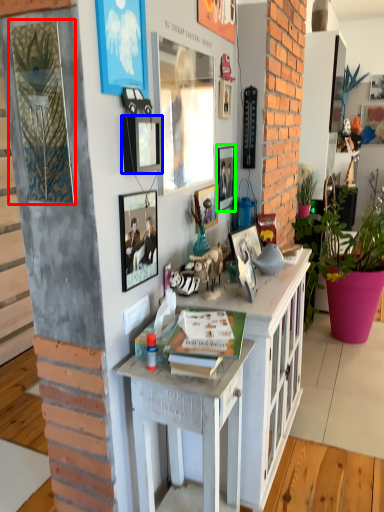
Question: Based on their relative distances, which object is farther from picture frame (highlighted by a red box)? Choose from picture frame (highlighted by a blue box) and picture frame (highlighted by a green box).

Choices:
 (A) picture frame
 (B) picture frame

Answer: (B)